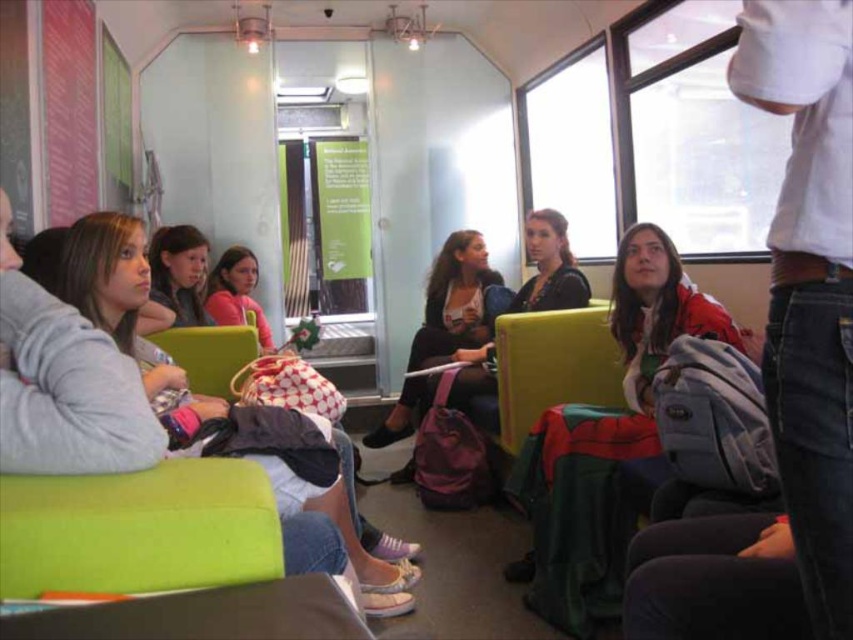
Question: Which point is closer to the camera taking this photo?

Choices:
 (A) (190, 346)
 (B) (235, 266)
 (C) (196, 228)

Answer: (A)

Question: Where is matte gray hoodie at left located in relation to matte black backpack at center in the image?

Choices:
 (A) above
 (B) below

Answer: (B)

Question: Does matte green chair at center have a smaller size compared to matte pink sweater at center?

Choices:
 (A) no
 (B) yes

Answer: (B)

Question: Does matte black jacket at upper left come in front of matte pink sweater at center?

Choices:
 (A) no
 (B) yes

Answer: (B)

Question: Which point appears farthest from the camera in this image?

Choices:
 (A) (242, 289)
 (B) (231, 362)
 (C) (456, 250)

Answer: (C)

Question: Which object is positioned farthest from the matte green chair at center?

Choices:
 (A) matte pink sweater at center
 (B) matte black backpack at center

Answer: (B)